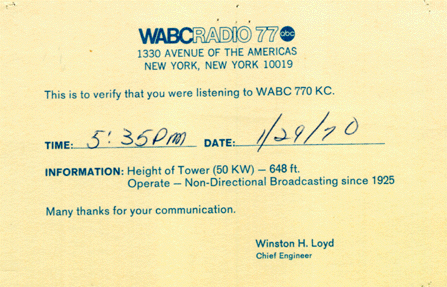
Locate an element on the screen. Image resolution: width=447 pixels, height=287 pixels. radio is located at coordinates (196, 36), (212, 38), (222, 40), (236, 40), (244, 37).